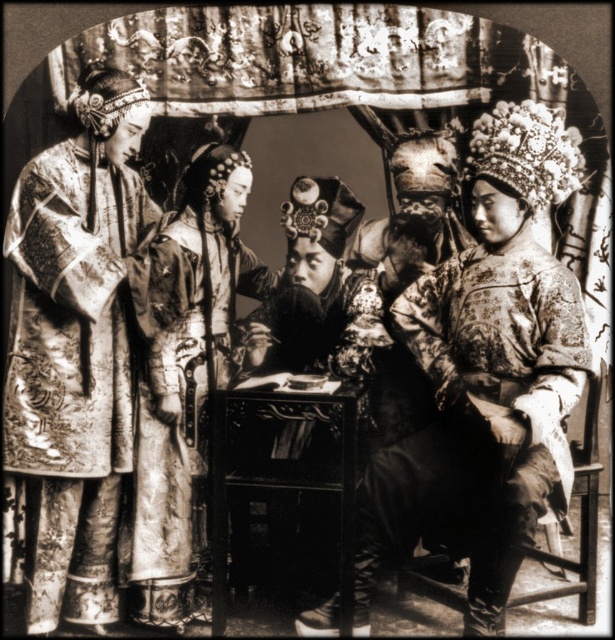
Question: Can you confirm if silky brocade robe at left is smaller than floral-patterned silk robe at center?

Choices:
 (A) no
 (B) yes

Answer: (B)

Question: Is silky brocade robe at left to the right of silky brocade robe at center from the viewer's perspective?

Choices:
 (A) yes
 (B) no

Answer: (B)

Question: Among these objects, which one is nearest to the camera?

Choices:
 (A) silky brocade robe at left
 (B) silky brocade robe at center

Answer: (A)

Question: Which of the following is the farthest from the observer?

Choices:
 (A) (200, 384)
 (B) (443, 352)
 (C) (98, 248)
 (D) (274, 380)

Answer: (A)

Question: Based on their relative distances, which object is farther from the silky brocade robe at center?

Choices:
 (A) wooden table at center
 (B) silky brocade robe at left

Answer: (A)

Question: Is silky brocade robe at left smaller than wooden table at center?

Choices:
 (A) yes
 (B) no

Answer: (B)